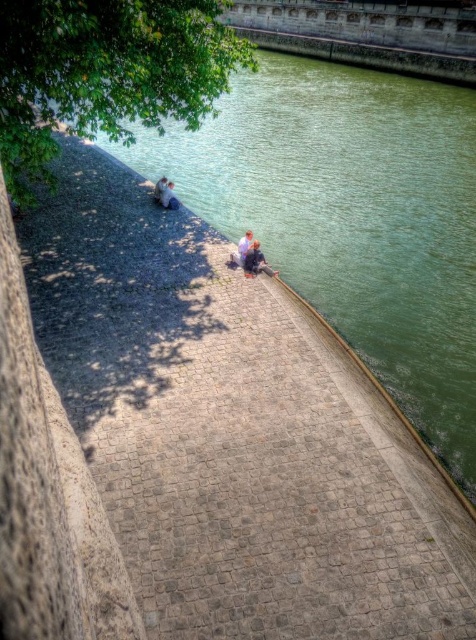
You are standing on the cobblestone walkway and want to take a photo of the green leafy tree at upper left without the green water at lower left in the shot. Is this possible?

Yes, because the green leafy tree at upper left is behind the green water at lower left, so you can position yourself so the tree is visible while the water is out of frame.

You are a photographer planning to take a portrait of the smooth skin couple at center. To ensure their faces are well lit, you want to position them so that the sunlight isn not directly shining on them. Given the current scene, where should you place the couple in relation to the green leafy tree at upper left?

You should position the smooth skin couple at center under the shadow cast by the green leafy tree at upper left. The tree is located above them, so its shadows can provide natural shade to avoid direct sunlight on their faces.

You are standing on the cobblestone walkway and want to find the green water at lower left. According to the scene description, where exactly should you look relative to your position?

The green water at lower left is located at point 0.341 on the x axis and 0.742 on the y axis relative to the image frame.